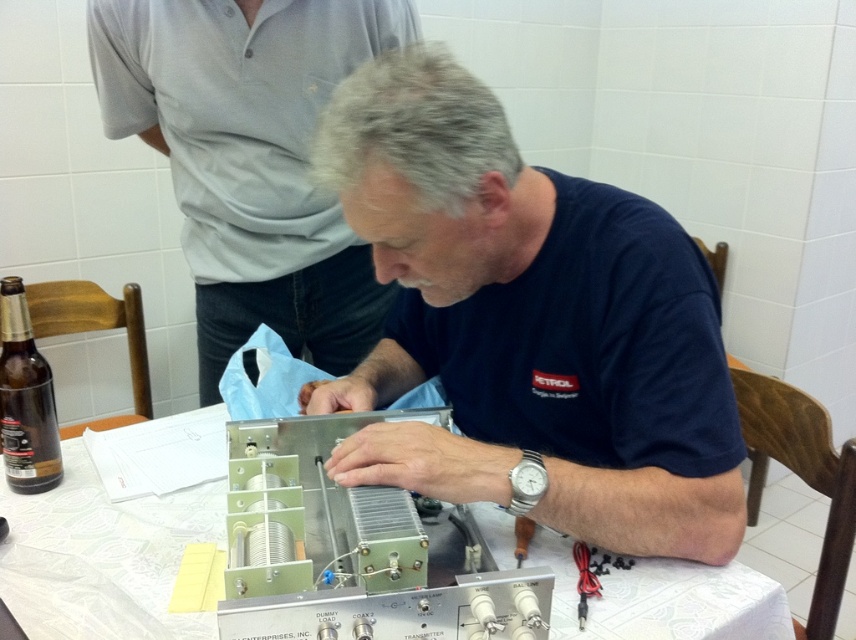
The image size is (856, 640). What do you see at coordinates (528, 323) in the screenshot? I see `blue fabric at center` at bounding box center [528, 323].

Does blue fabric at center appear on the left side of white paper at center?

Incorrect, blue fabric at center is not on the left side of white paper at center.

Where is `blue fabric at center`? blue fabric at center is located at coordinates (528, 323).

At what (x,y) coordinates should I click in order to perform the action: click on blue fabric at center. Please return your answer as a coordinate pair (x, y). The image size is (856, 640). Looking at the image, I should click on (528, 323).

Is point (615, 632) behind point (28, 340)?

No.

In the scene shown: Who is positioned more to the right, white paper at center or brown glass bottle at left?

From the viewer's perspective, white paper at center appears more on the right side.

I want to click on white paper at center, so click(x=132, y=506).

Does blue fabric at upper center appear over brown glass bottle at left?

Yes.

Is point (265, 284) closer to camera compared to point (31, 394)?

That is False.

The width and height of the screenshot is (856, 640). I want to click on blue fabric at upper center, so click(x=250, y=157).